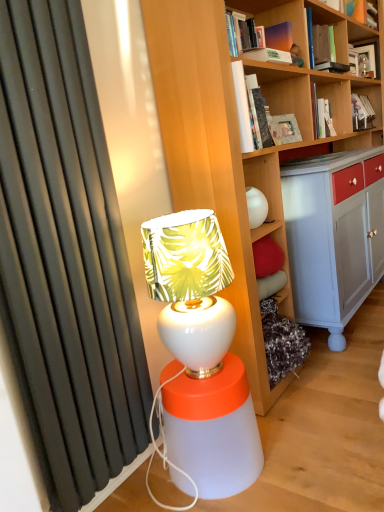
Question: Can you confirm if white glossy table lamp at center is positioned to the right of hardcover book at upper right, the second book ordered from the bottom?

Choices:
 (A) no
 (B) yes

Answer: (A)

Question: Is white glossy table lamp at center bigger than hardcover book at upper right, which appears as the 2th book when viewed from the back?

Choices:
 (A) no
 (B) yes

Answer: (B)

Question: Is white glossy table lamp at center wider than hardcover book at upper right, which appears as the 2th book when viewed from the back?

Choices:
 (A) no
 (B) yes

Answer: (B)

Question: Is white glossy table lamp at center thinner than hardcover book at upper right, the second book ordered from the bottom?

Choices:
 (A) no
 (B) yes

Answer: (A)

Question: Is white glossy table lamp at center aimed at hardcover book at upper right, which ranks as the fifth book in top-to-bottom order?

Choices:
 (A) no
 (B) yes

Answer: (A)

Question: Considering the relative positions of white glossy table lamp at center and hardcover book at upper right, marked as the 5th book in a front-to-back arrangement, in the image provided, is white glossy table lamp at center to the left of hardcover book at upper right, marked as the 5th book in a front-to-back arrangement, from the viewer's perspective?

Choices:
 (A) yes
 (B) no

Answer: (A)

Question: Does hardcover book at upper right, the second book ordered from the bottom, have a lesser height compared to matte black frame at upper right, positioned as the fifth book in bottom-to-top order?

Choices:
 (A) no
 (B) yes

Answer: (B)

Question: From a real-world perspective, is hardcover book at upper right, which appears as the 2th book when viewed from the back, under matte black frame at upper right, positioned as the fifth book in bottom-to-top order?

Choices:
 (A) yes
 (B) no

Answer: (A)

Question: Does hardcover book at upper right, marked as the 5th book in a front-to-back arrangement, touch matte black frame at upper right, positioned as the fifth book in bottom-to-top order?

Choices:
 (A) yes
 (B) no

Answer: (B)

Question: Considering the relative sizes of hardcover book at upper right, marked as the 5th book in a front-to-back arrangement, and matte black frame at upper right, arranged as the second book when viewed from the top, in the image provided, is hardcover book at upper right, marked as the 5th book in a front-to-back arrangement, smaller than matte black frame at upper right, arranged as the second book when viewed from the top,?

Choices:
 (A) yes
 (B) no

Answer: (A)

Question: Is hardcover book at upper right, marked as the 5th book in a front-to-back arrangement, further to the viewer compared to matte black frame at upper right, arranged as the second book when viewed from the top?

Choices:
 (A) no
 (B) yes

Answer: (A)

Question: Is hardcover book at upper right, the second book ordered from the bottom, to the right of matte black frame at upper right, marked as the 1th book in a back-to-front arrangement, from the viewer's perspective?

Choices:
 (A) no
 (B) yes

Answer: (A)

Question: Is matte orange book at upper right, which ranks as the third book in back-to-front order, beside white glossy table lamp at center?

Choices:
 (A) no
 (B) yes

Answer: (A)